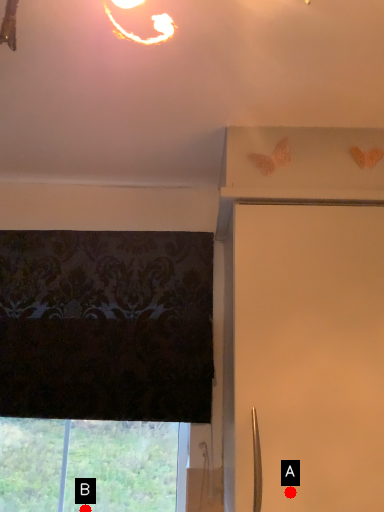
Question: Two points are circled on the image, labeled by A and B beside each circle. Which point appears closest to the camera in this image?

Choices:
 (A) A is closer
 (B) B is closer

Answer: (A)